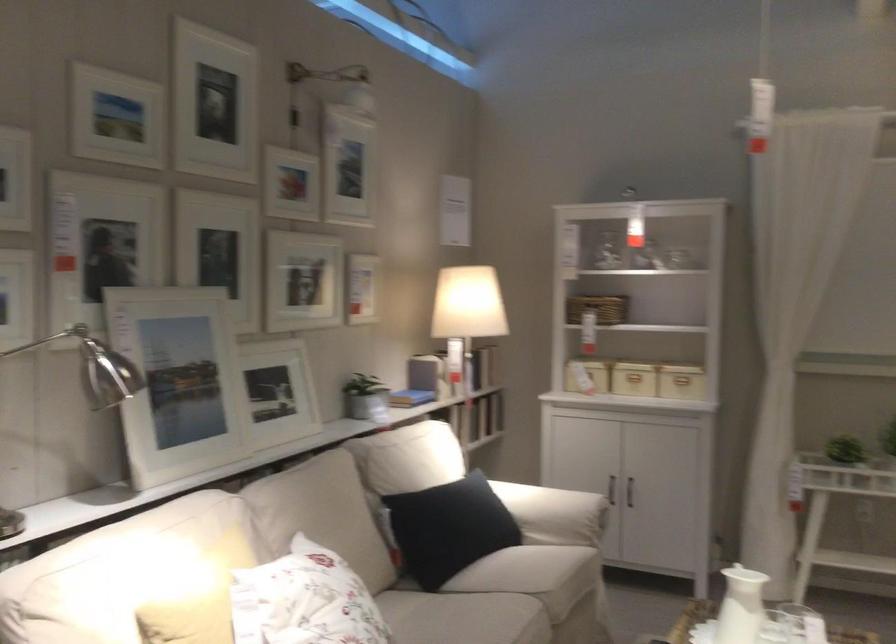
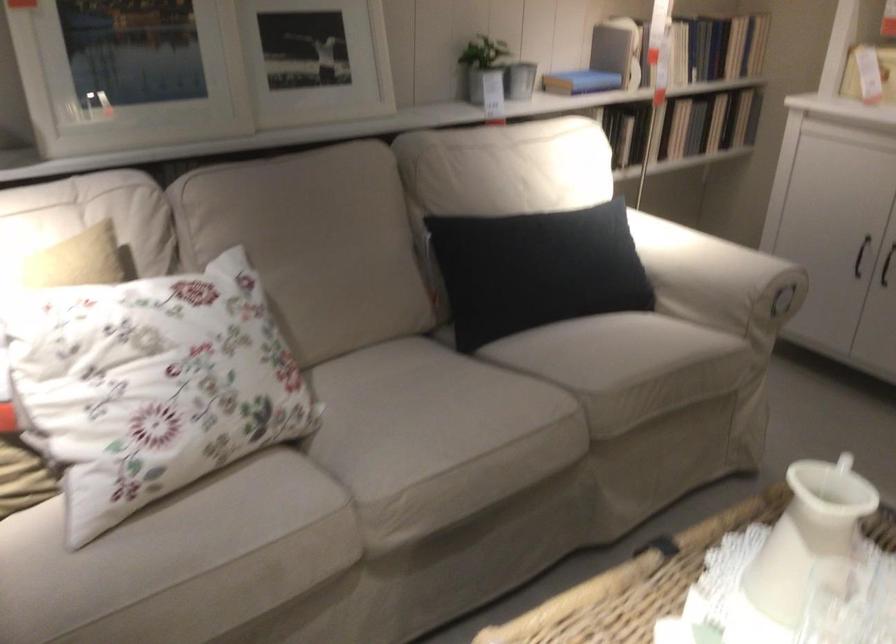
Find the pixel in the second image that matches (x=636, y=494) in the first image.

(886, 265)